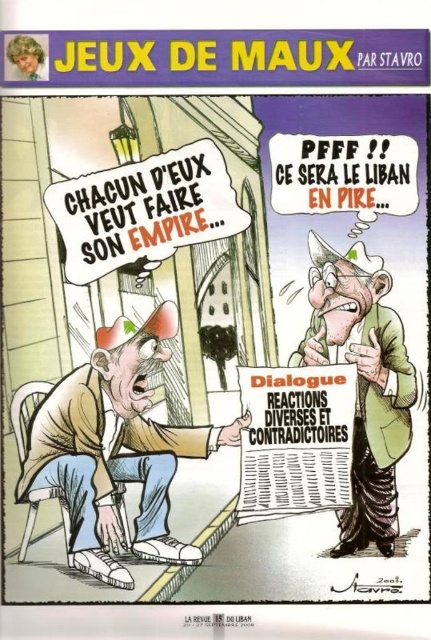
What are the coordinates of the white paper newspaper at center?

The white paper newspaper at center is located at coordinates point (x=296, y=440).

In the political cartoon, there are two objects of interest. The first is the white paper newspaper at center, and the second is the white canvas shoes at lower center. Given that the newspaper is larger than the shoes, can you determine which object takes up more visual space in the image?

The white paper newspaper at center is bigger than the white canvas shoes at lower center, so it takes up more visual space in the image.

What object is located at the coordinates point (296, 440) in the image?

The white paper newspaper at center is located at the coordinates point (296, 440).